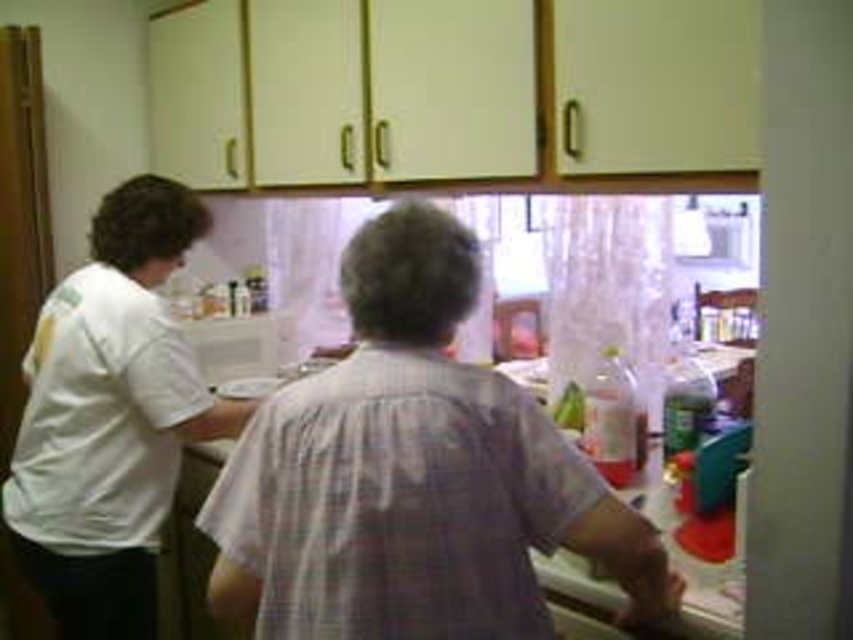
Question: Is white cotton shirt at center behind white matte shirt at left?

Choices:
 (A) yes
 (B) no

Answer: (B)

Question: Can you confirm if white cotton shirt at center is bigger than white matte shirt at left?

Choices:
 (A) yes
 (B) no

Answer: (B)

Question: Which of the following is the closest to the observer?

Choices:
 (A) white matte shirt at left
 (B) white cotton shirt at center

Answer: (B)

Question: Is white cotton shirt at center further to the viewer compared to white matte shirt at left?

Choices:
 (A) yes
 (B) no

Answer: (B)